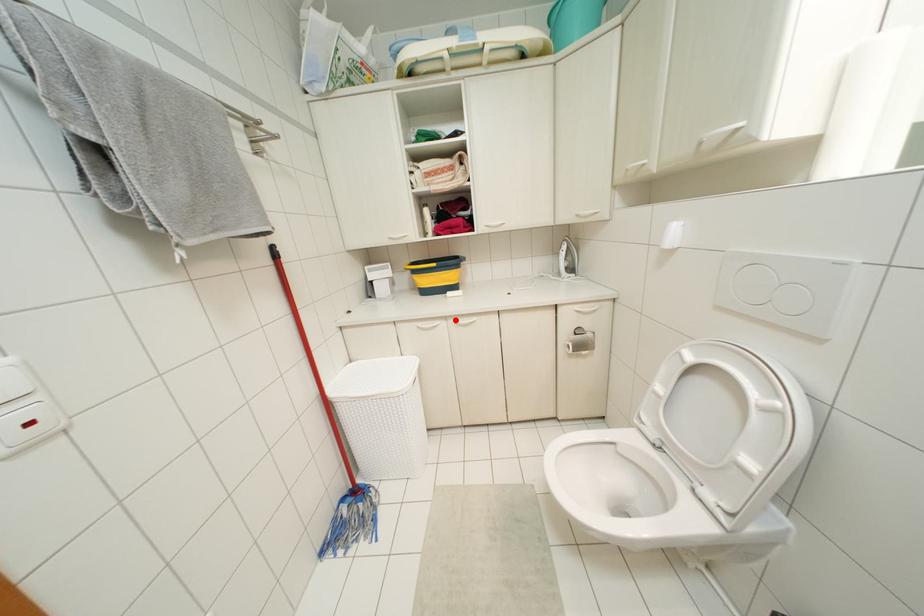
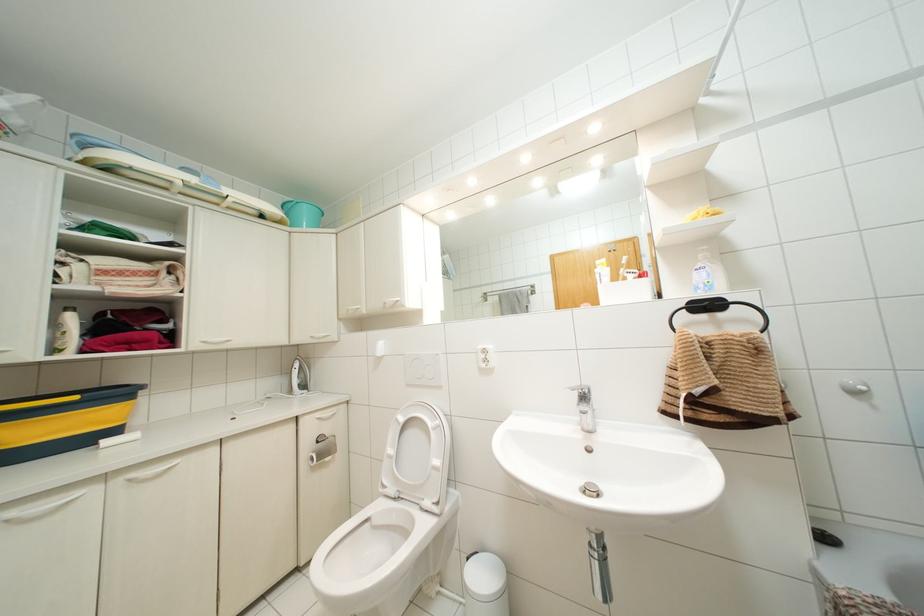
Locate, in the second image, the point that corresponds to the highlighted location in the first image.

(132, 475)